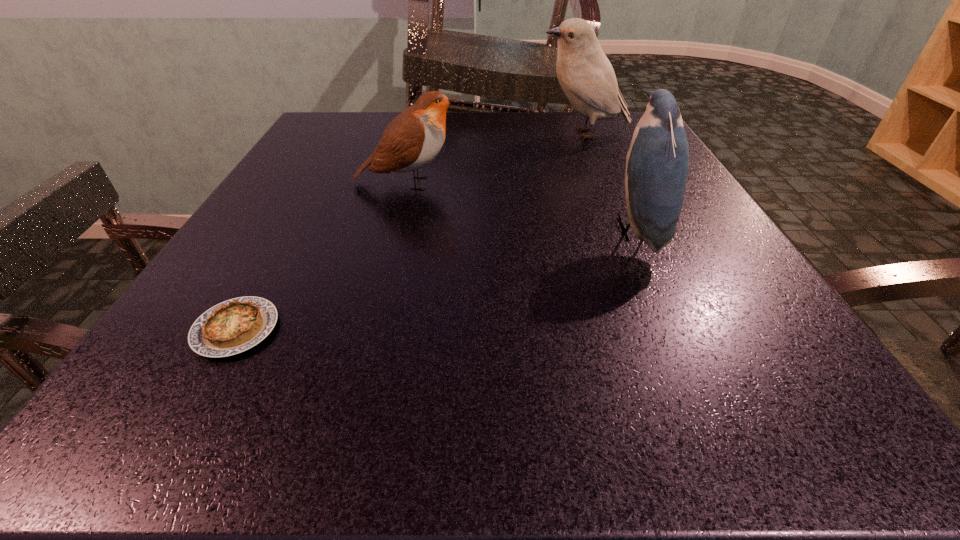
Identify the location of the farthest object. This screenshot has width=960, height=540. (585, 74).

The height and width of the screenshot is (540, 960). Identify the location of the second nearest object. (657, 163).

Image resolution: width=960 pixels, height=540 pixels. Find the location of `the leftmost bird`. the leftmost bird is located at coordinates (413, 139).

Where is `the shortest bird`? the shortest bird is located at coordinates (413, 139).

I want to click on the nearest object, so click(x=233, y=326).

Where is `the leftmost object`? The width and height of the screenshot is (960, 540). the leftmost object is located at coordinates (233, 326).

At what (x,y) coordinates should I click in order to perform the action: click on free location located at the beak of the farthest bird. Please return your answer as a coordinate pair (x, y). This screenshot has width=960, height=540. Looking at the image, I should click on (364, 133).

This screenshot has height=540, width=960. In order to click on vacant space located 0.210m at the beak of the farthest bird in this screenshot , I will do `click(446, 133)`.

Find the location of a particular element. The image size is (960, 540). vacant space located at the beak of the farthest bird is located at coordinates (493, 133).

Locate an element on the screen. The image size is (960, 540). free region located at the tip of the third farthest object's beak is located at coordinates (375, 230).